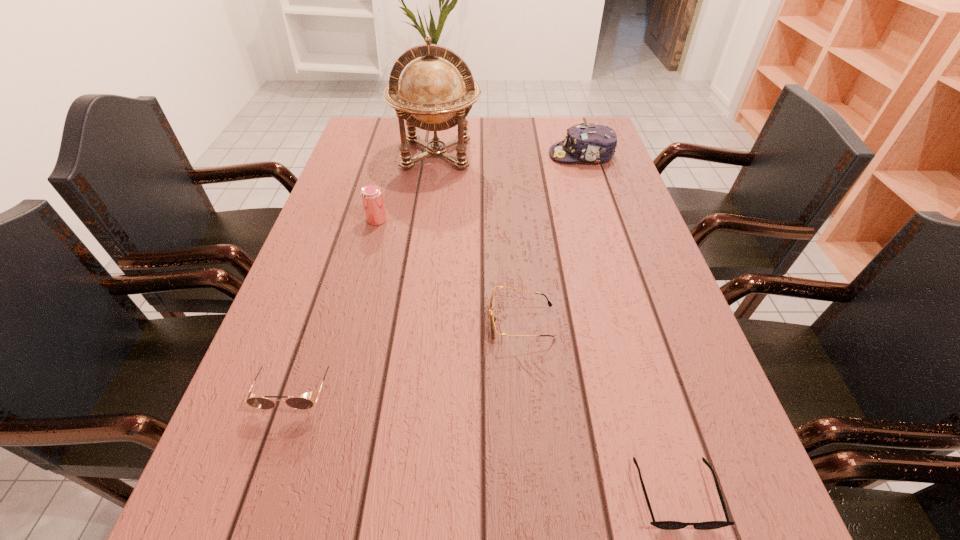
The image size is (960, 540). Identify the location of vacant space situated 0.140m on the front-facing side of the headwear. (504, 155).

I want to click on vacant space situated on the front-facing side of the headwear, so click(420, 155).

You are a GUI agent. You are given a task and a screenshot of the screen. Output one action in this format:
    pyautogui.click(x=<x>, y=<y>)
    Task: Click on the free space located on the front-facing side of the headwear
    This screenshot has height=540, width=960.
    Given the screenshot: What is the action you would take?
    pyautogui.click(x=479, y=155)

Where is `free space located on the front of the third farthest object`? free space located on the front of the third farthest object is located at coordinates (357, 292).

Where is `vacant space situated 0.190m on the front lenses of the second farthest sunglasses`? The width and height of the screenshot is (960, 540). vacant space situated 0.190m on the front lenses of the second farthest sunglasses is located at coordinates (246, 539).

At what (x,y) coordinates should I click in order to perform the action: click on blank space located on the lenses of the fifth tallest object. Please return your answer as a coordinate pair (x, y). Image resolution: width=960 pixels, height=540 pixels. Looking at the image, I should click on (333, 322).

Find the location of a particular element. vacant area situated 0.120m on the lenses of the fifth tallest object is located at coordinates 431,322.

Image resolution: width=960 pixels, height=540 pixels. I want to click on free spot located on the lenses of the fifth tallest object, so click(x=396, y=322).

Locate an element on the screen. globe that is at the far edge is located at coordinates (431, 95).

Find the location of `headwear that is at the far edge`. headwear that is at the far edge is located at coordinates (596, 143).